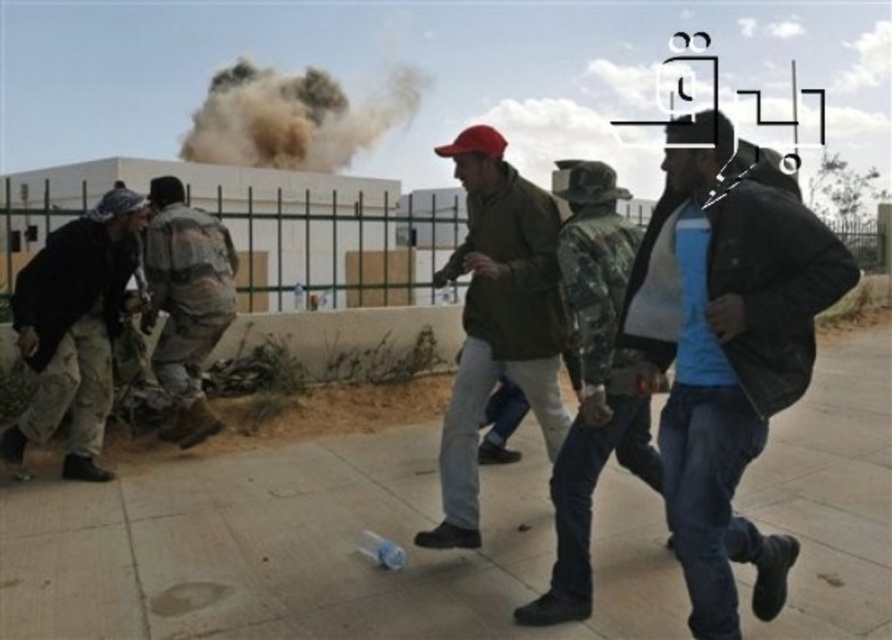
You are a drone operator trying to capture a clear image of two critical points in the scene. The first point is at coordinates point (348,157) and the second is at point (164,355). Since you can only focus on one point at a time, which point should you prioritize to ensure it appears closer and more detailed in your footage?

Point (348,157) is further to the viewer than point (164,355), so you should prioritize focusing on point (348,157) to ensure it appears closer and more detailed in your footage.

You are a photographer trying to capture the scene of the explosion. You notice the blue denim jeans at center and the brown dusty cloud at upper center. Which object should you focus on if you want to capture the taller one?

The brown dusty cloud at upper center is taller than the blue denim jeans at center, so you should focus on the brown dusty cloud at upper center to capture the taller one.